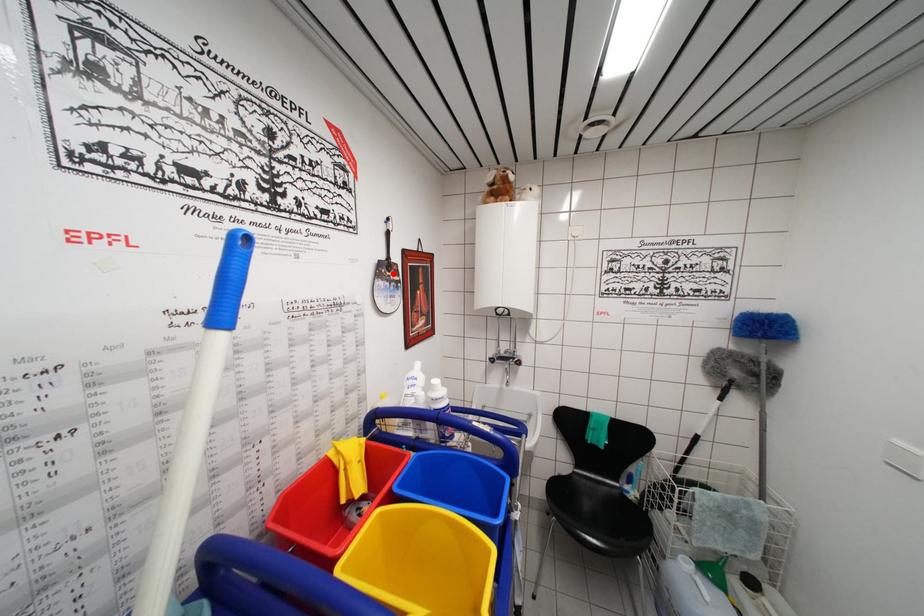
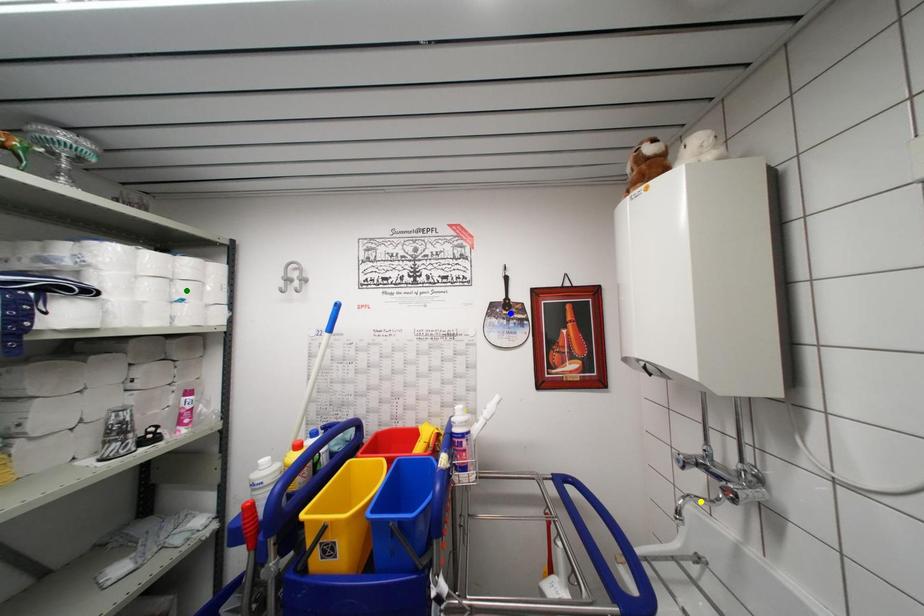
Question: I am providing you with two images of the same scene from different viewpoints. A red point is marked on the first image. You are given multiple points on the second image. Can you choose the point in image 2 that corresponds to the point in image 1?

Choices:
 (A) blue point
 (B) green point
 (C) yellow point

Answer: (A)